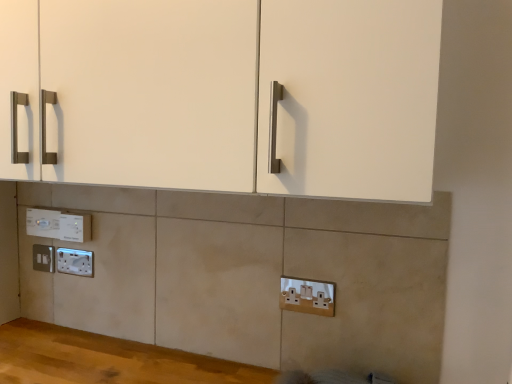
Question: From a real-world perspective, is white plastic electric outlet at lower left, positioned as the 1th electric outlet in back-to-front order, positioned under white plastic socket at lower center, arranged as the 5th electric outlet when viewed from the left, based on gravity?

Choices:
 (A) no
 (B) yes

Answer: (A)

Question: From the image's perspective, would you say white plastic electric outlet at lower left, which ranks as the fifth electric outlet in right-to-left order, is positioned over white plastic socket at lower center, arranged as the 5th electric outlet when viewed from the left?

Choices:
 (A) yes
 (B) no

Answer: (A)

Question: Can you confirm if white plastic electric outlet at lower left, which appears as the fifth electric outlet when viewed from the front, is shorter than white plastic socket at lower center, arranged as the 5th electric outlet when viewed from the left?

Choices:
 (A) no
 (B) yes

Answer: (B)

Question: Is white plastic electric outlet at lower left, which appears as the fifth electric outlet when viewed from the front, closer to the viewer compared to white plastic socket at lower center, which is the fifth electric outlet in back-to-front order?

Choices:
 (A) yes
 (B) no

Answer: (B)

Question: Is white plastic electric outlet at lower left, which ranks as the fifth electric outlet in right-to-left order, further to the viewer compared to white plastic socket at lower center, the 1th electric outlet viewed from the right?

Choices:
 (A) yes
 (B) no

Answer: (A)

Question: Considering the positions of white plastic electric outlet at lower left, positioned as the 1th electric outlet in back-to-front order, and white plastic electric outlet at lower left, which is the fourth electric outlet in back-to-front order, in the image, is white plastic electric outlet at lower left, positioned as the 1th electric outlet in back-to-front order, bigger or smaller than white plastic electric outlet at lower left, which is the fourth electric outlet in back-to-front order,?

Choices:
 (A) big
 (B) small

Answer: (B)

Question: Would you say white plastic electric outlet at lower left, positioned as the 1th electric outlet in back-to-front order, is to the left or to the right of white plastic electric outlet at lower left, the fourth electric outlet viewed from the left, in the picture?

Choices:
 (A) right
 (B) left

Answer: (B)

Question: Does point (51, 268) appear closer or farther from the camera than point (84, 231)?

Choices:
 (A) farther
 (B) closer

Answer: (A)

Question: Considering the positions of white plastic electric outlet at lower left, which appears as the fifth electric outlet when viewed from the front, and white plastic electric outlet at lower left, the 2th electric outlet viewed from the front, in the image, is white plastic electric outlet at lower left, which appears as the fifth electric outlet when viewed from the front, wider or thinner than white plastic electric outlet at lower left, the 2th electric outlet viewed from the front,?

Choices:
 (A) wide
 (B) thin

Answer: (B)

Question: Based on their sizes in the image, would you say white plastic electric outlet at lower left, which is the fourth electric outlet in back-to-front order, is bigger or smaller than white plastic socket at lower center, which is the fifth electric outlet in back-to-front order?

Choices:
 (A) big
 (B) small

Answer: (A)

Question: From a real-world perspective, is white plastic electric outlet at lower left, the 2th electric outlet when ordered from right to left, above or below white plastic socket at lower center, arranged as the 5th electric outlet when viewed from the left?

Choices:
 (A) above
 (B) below

Answer: (A)

Question: Considering their positions, is white plastic electric outlet at lower left, the 2th electric outlet when ordered from right to left, located in front of or behind white plastic socket at lower center, arranged as the 5th electric outlet when viewed from the left?

Choices:
 (A) front
 (B) behind

Answer: (B)

Question: From the image's perspective, is white plastic electric outlet at lower left, the 2th electric outlet viewed from the front, positioned above or below white plastic socket at lower center, arranged as the 5th electric outlet when viewed from the left?

Choices:
 (A) above
 (B) below

Answer: (A)

Question: From the image's perspective, is white plastic socket at lower left, the third electric outlet positioned from the right, above or below white plastic electric outlet at lower left, the 2th electric outlet when ordered from right to left?

Choices:
 (A) below
 (B) above

Answer: (A)

Question: Is white plastic socket at lower left, acting as the third electric outlet starting from the left, in front of or behind white plastic electric outlet at lower left, which is the fourth electric outlet in back-to-front order, in the image?

Choices:
 (A) behind
 (B) front

Answer: (A)